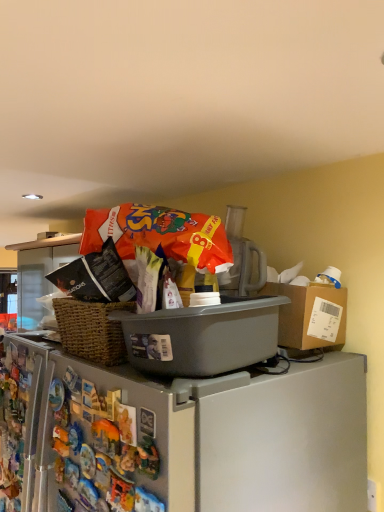
Where is `gray plastic container at upper center`? This screenshot has width=384, height=512. gray plastic container at upper center is located at coordinates (202, 337).

Describe the element at coordinates (202, 337) in the screenshot. I see `gray plastic container at upper center` at that location.

You are a GUI agent. You are given a task and a screenshot of the screen. Output one action in this format:
    pyautogui.click(x=<x>, y=<y>)
    Task: Click on the gray plastic container at upper center
    Image resolution: width=384 pixels, height=512 pixels.
    Given the screenshot: What is the action you would take?
    pos(202,337)